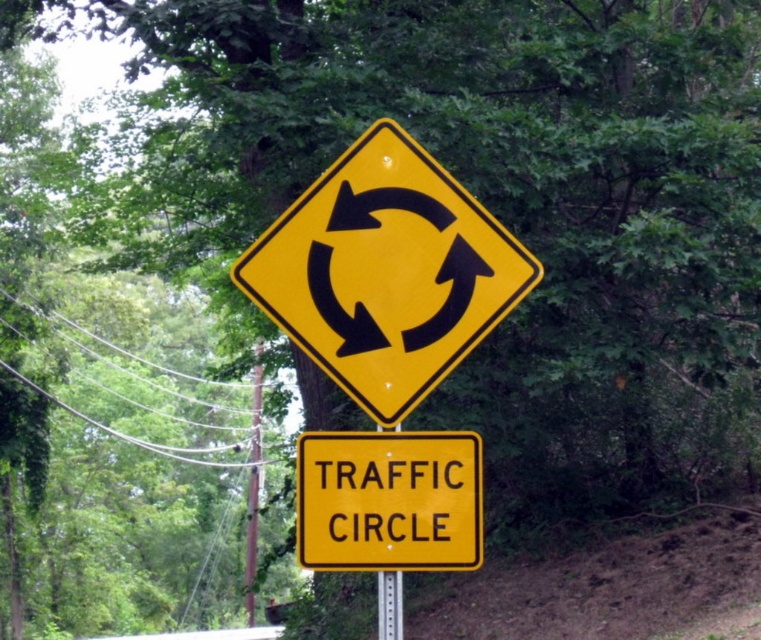
You are a driver approaching a traffic sign and need to determine if the yellow reflective diamond at center is taller than the metallic silver pole at center. Based on the scene, can you confirm this?

The yellow reflective diamond at center has a greater height compared to the metallic silver pole at center, so yes, the yellow reflective diamond at center is taller than the metallic silver pole at center.

You are a pedestrian standing at the base of the brown wooden pole at center. You want to reach the yellow reflective diamond at center to read its traffic circle warning. Can you walk directly to it without any obstacles?

The yellow reflective diamond at center is 17.89 meters away from the brown wooden pole at center. Since there are no obstacles mentioned in the scene description, you can walk directly to it.